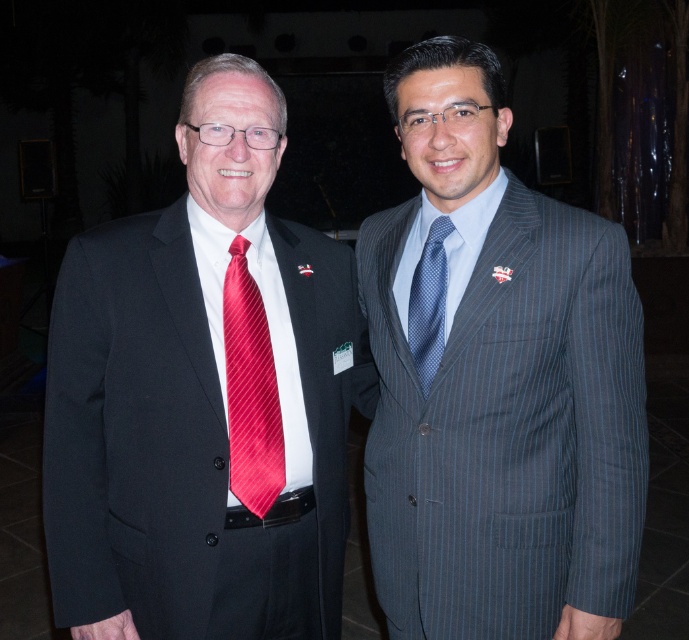
Question: Which point appears closest to the camera in this image?

Choices:
 (A) (247, 284)
 (B) (504, 557)
 (C) (79, 634)
 (D) (418, 323)

Answer: (C)

Question: Which of the following is the farthest from the observer?

Choices:
 (A) (435, 308)
 (B) (113, 470)
 (C) (267, 413)

Answer: (A)

Question: Is blue pinstripe suit at center further to camera compared to matte black suit at left?

Choices:
 (A) no
 (B) yes

Answer: (A)

Question: Estimate the real-world distances between objects in this image. Which object is closer to the blue pinstripe suit at center?

Choices:
 (A) shiny red tie at center
 (B) blue dotted tie at center
 (C) matte black suit at left

Answer: (B)

Question: From the image, what is the correct spatial relationship of blue pinstripe suit at center in relation to blue dotted tie at center?

Choices:
 (A) right
 (B) left

Answer: (A)

Question: Can you confirm if matte black suit at left is bigger than shiny red tie at center?

Choices:
 (A) no
 (B) yes

Answer: (B)